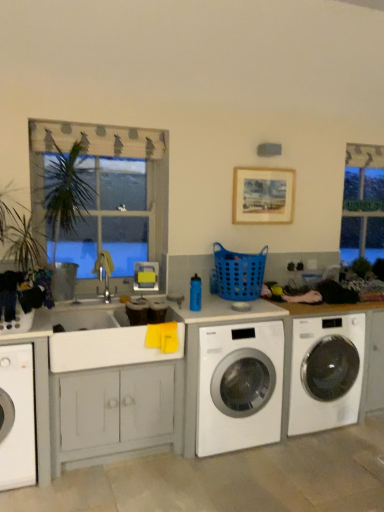
Question: Can you confirm if white glossy washing machine at lower left, the 3th washing machine in the right-to-left sequence, is taller than wooden frame at upper left?

Choices:
 (A) no
 (B) yes

Answer: (A)

Question: Does white glossy washing machine at lower left, the first washing machine in the left-to-right sequence, have a lesser height compared to wooden frame at upper left?

Choices:
 (A) no
 (B) yes

Answer: (B)

Question: From the image's perspective, is white glossy washing machine at lower left, the first washing machine in the left-to-right sequence, over wooden frame at upper left?

Choices:
 (A) no
 (B) yes

Answer: (A)

Question: From a real-world perspective, is white glossy washing machine at lower left, the first washing machine in the left-to-right sequence, physically above wooden frame at upper left?

Choices:
 (A) yes
 (B) no

Answer: (B)

Question: Considering the relative positions of white glossy washing machine at lower left, the 3th washing machine in the right-to-left sequence, and wooden frame at upper left in the image provided, is white glossy washing machine at lower left, the 3th washing machine in the right-to-left sequence, behind wooden frame at upper left?

Choices:
 (A) no
 (B) yes

Answer: (A)

Question: Is wooden frame at upper left completely or partially inside white glossy washing machine at lower left, the first washing machine in the left-to-right sequence?

Choices:
 (A) yes
 (B) no

Answer: (B)

Question: Is white glossy washing machine at center, which appears as the first washing machine when viewed from the right, positioned before green glass sign at upper right?

Choices:
 (A) yes
 (B) no

Answer: (A)

Question: Is white glossy washing machine at center, which appears as the first washing machine when viewed from the right, wider than green glass sign at upper right?

Choices:
 (A) no
 (B) yes

Answer: (B)

Question: Considering the relative positions of white glossy washing machine at center, the 3th washing machine in the left-to-right sequence, and green glass sign at upper right in the image provided, is white glossy washing machine at center, the 3th washing machine in the left-to-right sequence, to the left of green glass sign at upper right from the viewer's perspective?

Choices:
 (A) no
 (B) yes

Answer: (B)

Question: From a real-world perspective, is white glossy washing machine at center, the 3th washing machine in the left-to-right sequence, positioned over green glass sign at upper right based on gravity?

Choices:
 (A) yes
 (B) no

Answer: (B)

Question: From the image's perspective, is white glossy washing machine at center, the 3th washing machine in the left-to-right sequence, below green glass sign at upper right?

Choices:
 (A) no
 (B) yes

Answer: (B)

Question: Does white glossy washing machine at center, which appears as the first washing machine when viewed from the right, have a greater height compared to green glass sign at upper right?

Choices:
 (A) yes
 (B) no

Answer: (B)

Question: Is wooden framed artwork at upper center oriented away from green glass sign at upper right?

Choices:
 (A) no
 (B) yes

Answer: (A)